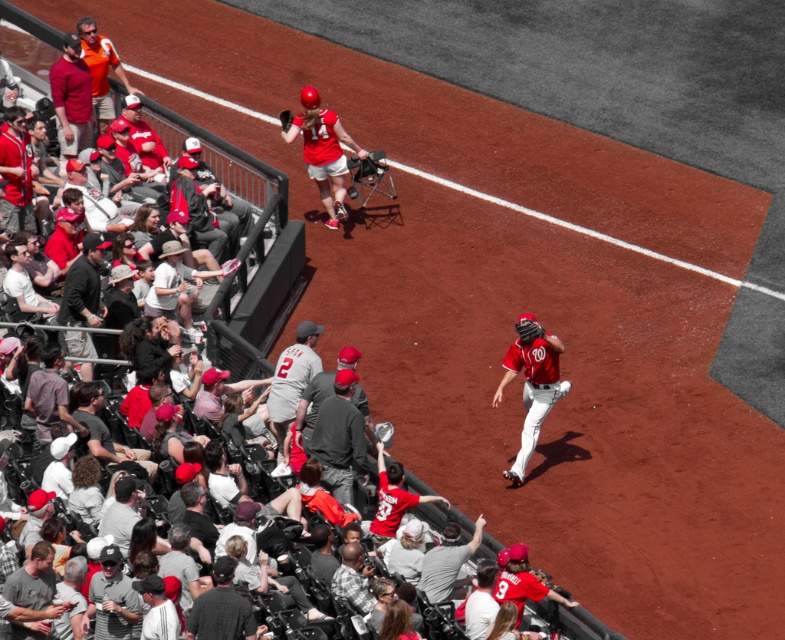
Question: Can you confirm if red jersey baseball player at center is bigger than dark brown leather glove at upper center?

Choices:
 (A) yes
 (B) no

Answer: (A)

Question: Does matte red jersey at center have a lesser width compared to matte red helmet at upper center?

Choices:
 (A) no
 (B) yes

Answer: (B)

Question: Which of these objects is positioned closest to the matte red jersey at center?

Choices:
 (A) red jersey baseball player at center
 (B) matte red helmet at upper center
 (C) dark brown leather glove at upper center

Answer: (A)

Question: Which object is farther from the camera taking this photo?

Choices:
 (A) matte red helmet at upper center
 (B) matte red jersey at center
 (C) dark brown leather glove at upper center
 (D) red jersey baseball player at center

Answer: (C)

Question: Can you confirm if red jersey baseball player at center is positioned to the left of matte red helmet at upper center?

Choices:
 (A) yes
 (B) no

Answer: (B)

Question: Which is nearer to the red jersey baseball player at center?

Choices:
 (A) matte red helmet at upper center
 (B) dark brown leather glove at upper center

Answer: (A)